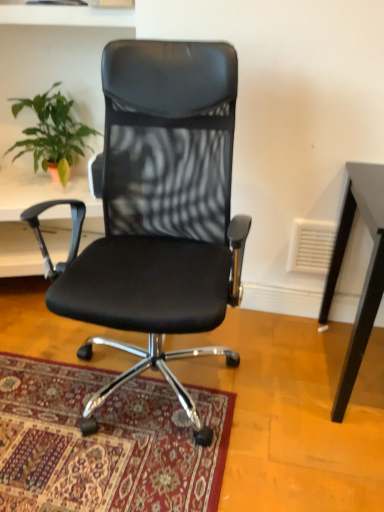
Image resolution: width=384 pixels, height=512 pixels. I want to click on vacant space underneath black leather office chair at center (from a real-world perspective), so click(154, 354).